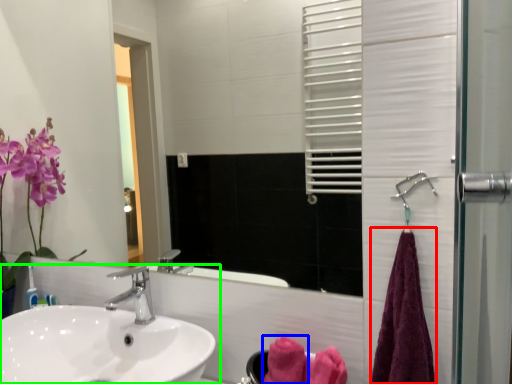
Question: Considering the real-world distances, which object is farthest from bath towel (highlighted by a red box)? bath towel (highlighted by a blue box) or sink (highlighted by a green box)?

Choices:
 (A) bath towel
 (B) sink

Answer: (B)